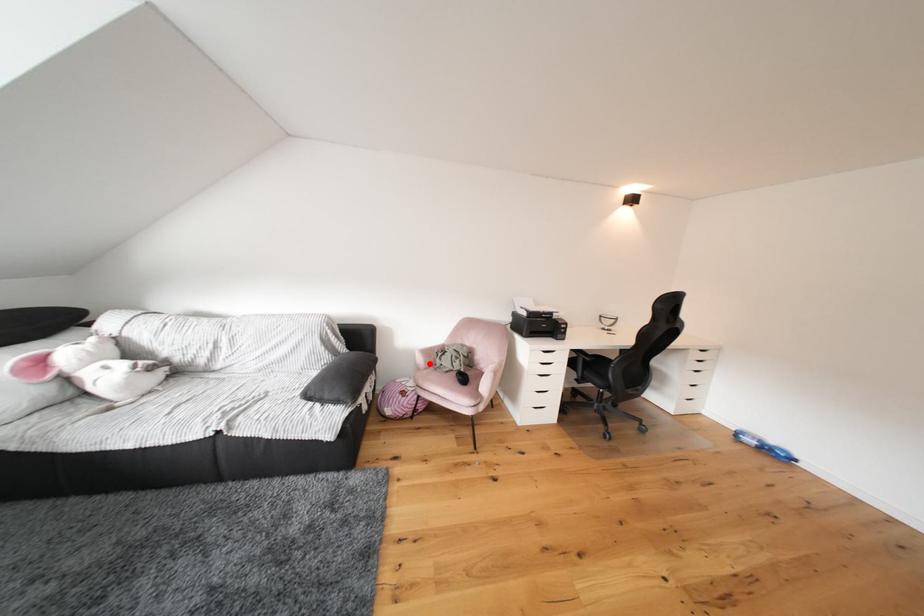
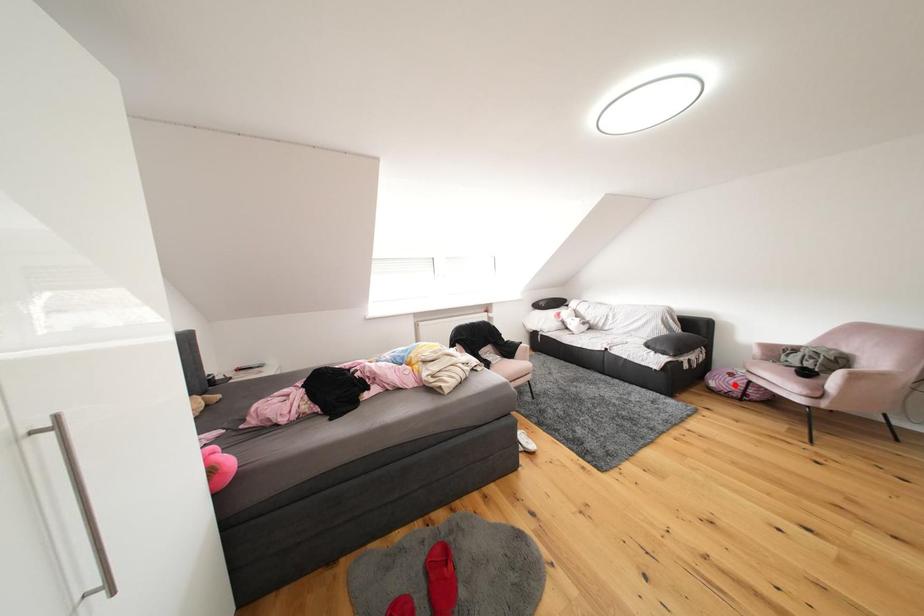
I am providing you with two images of the same scene from different viewpoints. A red point is marked on the first image and another point is marked on the second image. Is the marked point in image1 the same physical position as the marked point in image2?

No